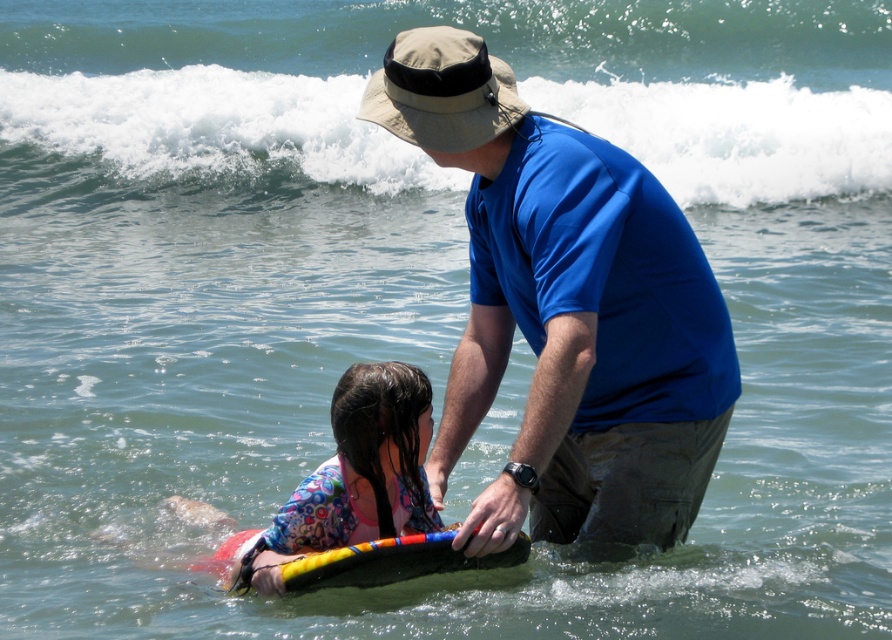
Question: Is blue fabric shirt at center to the right of white foamy wave at upper center from the viewer's perspective?

Choices:
 (A) yes
 (B) no

Answer: (A)

Question: Is white foamy wave at upper center positioned at the back of floral fabric swimsuit at lower left?

Choices:
 (A) no
 (B) yes

Answer: (B)

Question: Is white foamy wave at upper center to the right of floral fabric swimsuit at lower left from the viewer's perspective?

Choices:
 (A) no
 (B) yes

Answer: (A)

Question: Among these points, which one is nearest to the camera?

Choices:
 (A) (426, 449)
 (B) (613, 445)
 (C) (742, 116)

Answer: (B)

Question: Which of the following is the closest to the observer?

Choices:
 (A) (390, 508)
 (B) (831, 106)
 (C) (384, 90)

Answer: (C)

Question: Which of the following is the farthest from the observer?

Choices:
 (A) [x=550, y=461]
 (B) [x=286, y=502]

Answer: (B)